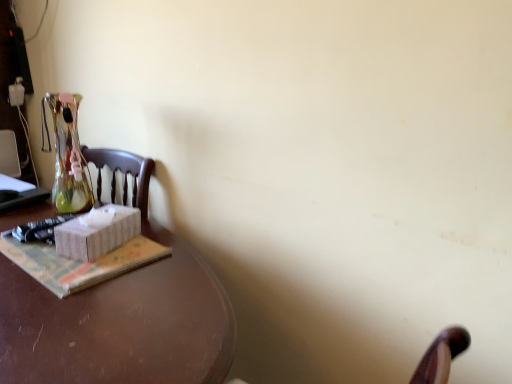
I want to click on blank space situated above white paper at left (from a real-world perspective), so click(x=68, y=253).